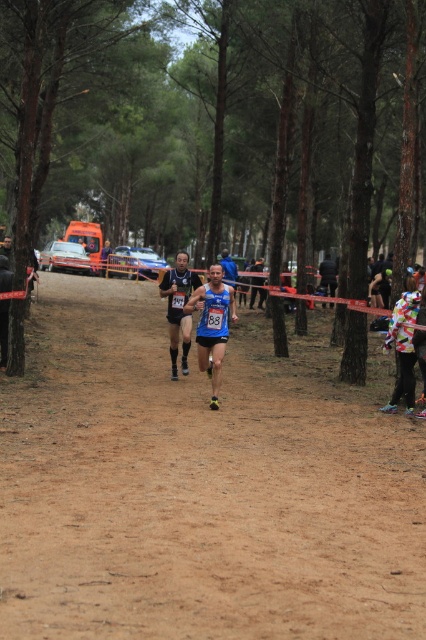
You are a race official trying to identify the lead runner in the image. Both the blue fabric running suit at center and the matte blue running suit at center are visible. Which runner is ahead?

The blue fabric running suit at center is smaller than the matte blue running suit at center, so the runner in the blue fabric running suit at center is closer and therefore ahead.

You are a photographer positioned at the edge of the forest trail. You want to capture a photo where both the brown dirt track at center and the matte blue running suit at center are clearly visible. Considering their sizes, which object should you focus on to ensure both are in frame?

Since the brown dirt track at center is larger than the matte blue running suit at center, you should focus on the brown dirt track at center to ensure both objects are in frame as the larger object will occupy more space and the smaller one can fit within the same frame.

You are a runner participating in the race and see the multicolored fabric at right in the distance. If you want to reach it as quickly as possible, should you adjust your direction to the left or right?

The multicolored fabric at right is located at point [402,346], which is to the right of the center. Therefore, to reach it quickly, you should adjust your direction to the right.